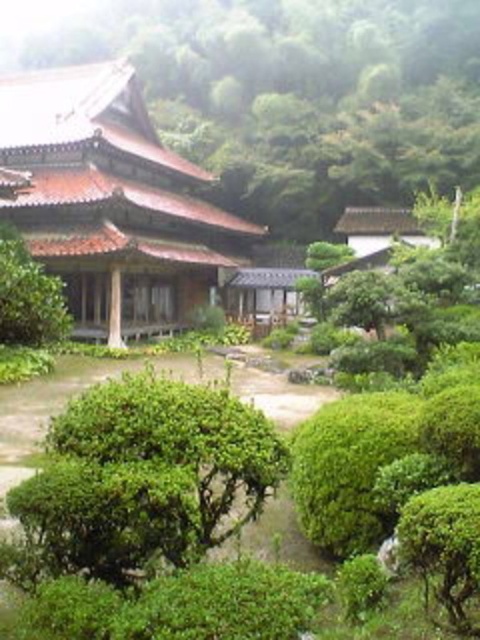
Is green leafy tree at upper center smaller than brown tile roof at center?

No, green leafy tree at upper center is not smaller than brown tile roof at center.

Is the position of green leafy tree at upper center more distant than that of brown tile roof at center?

Yes, green leafy tree at upper center is further from the viewer.

What are the coordinates of `green leafy tree at upper center` in the screenshot? It's located at (294, 93).

This screenshot has width=480, height=640. In order to click on green leafy tree at upper center in this screenshot , I will do `click(294, 93)`.

Can you confirm if brown tile roof at center is thinner than green leafy bush at center?

No, brown tile roof at center is not thinner than green leafy bush at center.

Who is higher up, brown tile roof at center or green leafy bush at center?

Positioned higher is brown tile roof at center.

Locate an element on the screen. brown tile roof at center is located at coordinates (111, 202).

Which is more to the left, green leafy bush at lower right or green leafy bush at center?

Positioned to the left is green leafy bush at center.

Describe the element at coordinates (444, 547) in the screenshot. I see `green leafy bush at lower right` at that location.

Locate an element on the screen. The width and height of the screenshot is (480, 640). green leafy bush at lower right is located at coordinates (444, 547).